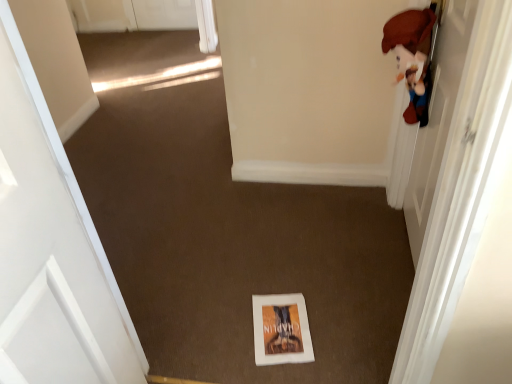
Question: Considering their positions, is white glossy door at upper right, which is counted as the first door, starting from the right, located in front of or behind white matte door at left, positioned as the 2th door in right-to-left order?

Choices:
 (A) front
 (B) behind

Answer: (B)

Question: Is point (459, 261) positioned closer to the camera than point (66, 264)?

Choices:
 (A) closer
 (B) farther

Answer: (A)

Question: Which object is the farthest from the white matte door at left, positioned as the 2th door in right-to-left order?

Choices:
 (A) white paper book at center
 (B) white glossy door at upper right, which is counted as the first door, starting from the right

Answer: (B)

Question: Estimate the real-world distances between objects in this image. Which object is closer to the white paper book at center?

Choices:
 (A) white glossy door at upper right, positioned as the 2th door in left-to-right order
 (B) white matte door at left, positioned as the 2th door in right-to-left order

Answer: (A)